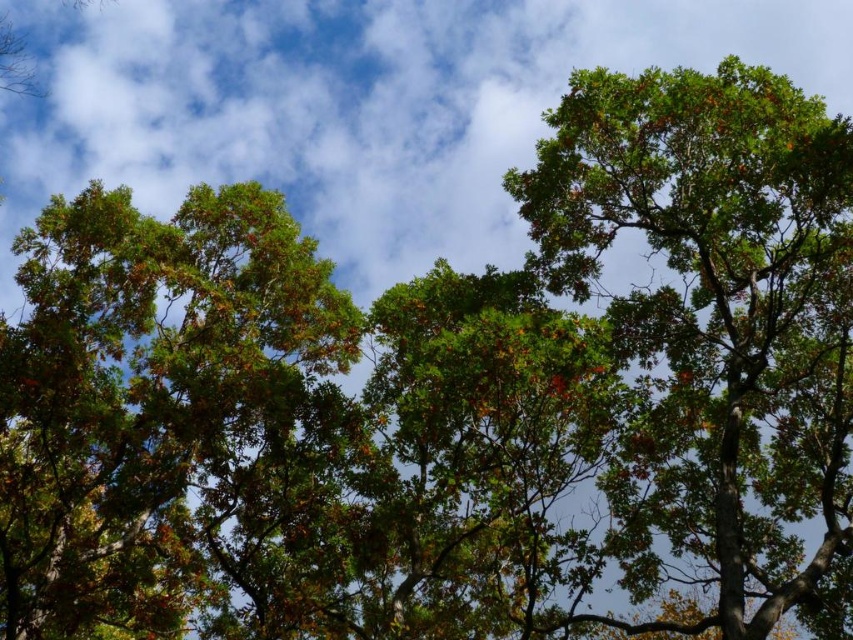
Question: Is green leafy tree at upper left above green leafy tree at upper right?

Choices:
 (A) yes
 (B) no

Answer: (A)

Question: Which object is closer to the camera taking this photo?

Choices:
 (A) green leafy tree at upper left
 (B) green leafy tree at upper right

Answer: (B)

Question: Is green leafy tree at upper left thinner than green leafy tree at upper right?

Choices:
 (A) yes
 (B) no

Answer: (A)

Question: Considering the relative positions of green leafy tree at upper left and green leafy tree at upper right in the image provided, where is green leafy tree at upper left located with respect to green leafy tree at upper right?

Choices:
 (A) left
 (B) right

Answer: (A)

Question: Which point is farther to the camera?

Choices:
 (A) green leafy tree at upper right
 (B) green leafy tree at upper left

Answer: (B)

Question: Which of the following is the closest to the observer?

Choices:
 (A) green leafy tree at upper left
 (B) green leafy tree at upper right

Answer: (B)